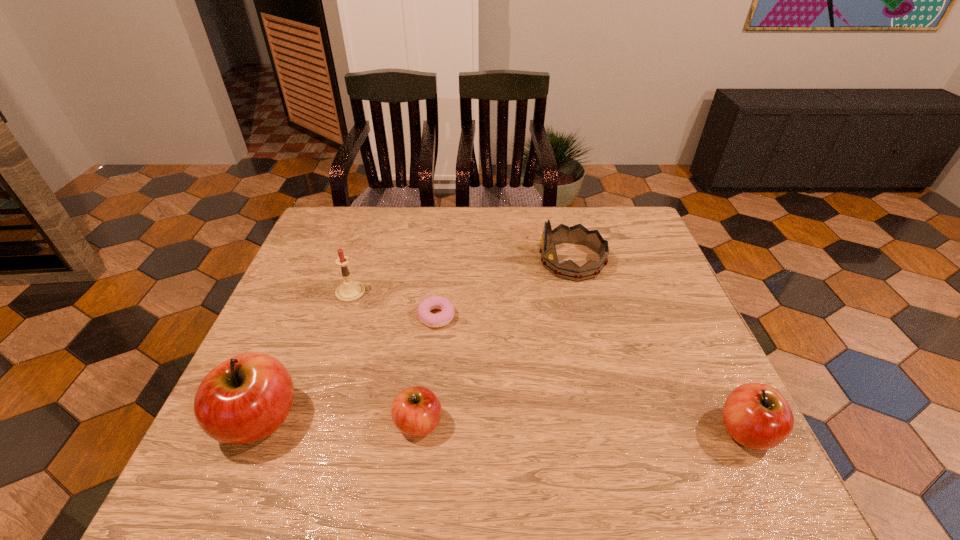
This screenshot has height=540, width=960. What are the coordinates of `free region located on the right of the shortest apple` in the screenshot? It's located at (638, 423).

Identify the location of vacant space located 0.310m on the left of the third shortest object. This screenshot has width=960, height=540. (563, 431).

Where is `free space located 0.050m at the front of the tiara with jewels`? The image size is (960, 540). free space located 0.050m at the front of the tiara with jewels is located at coordinates (521, 261).

Image resolution: width=960 pixels, height=540 pixels. I want to click on vacant area located at the front of the tiara with jewels, so click(450, 261).

Identify the location of free space located 0.350m at the front of the tiara with jewels. (420, 261).

Where is `free space located on the left of the shortest object`? This screenshot has width=960, height=540. free space located on the left of the shortest object is located at coordinates (328, 316).

This screenshot has width=960, height=540. What are the coordinates of `free space located 0.180m on the front of the candle` in the screenshot? It's located at (330, 356).

You are a GUI agent. You are given a task and a screenshot of the screen. Output one action in this format:
    pyautogui.click(x=<x>, y=<y>)
    Task: Click on the object that is at the far edge
    Image resolution: width=960 pixels, height=540 pixels.
    Given the screenshot: What is the action you would take?
    pyautogui.click(x=578, y=234)

This screenshot has width=960, height=540. I want to click on apple present at the left edge, so click(246, 398).

Identify the location of candle located at the left edge. This screenshot has width=960, height=540. (349, 291).